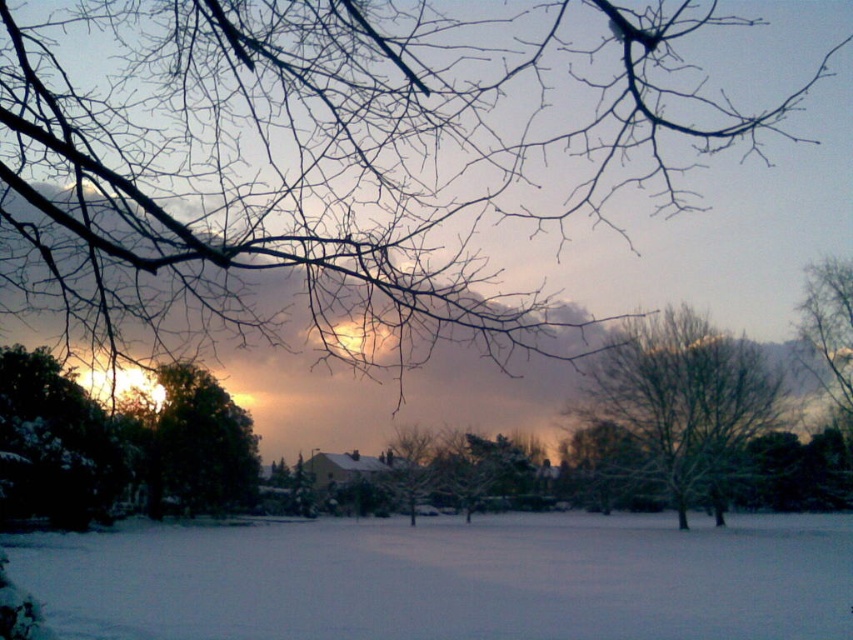
Question: Can you confirm if white powdery snow at center is positioned to the left of bare branches at upper right?

Choices:
 (A) no
 (B) yes

Answer: (B)

Question: Which point appears farthest from the camera in this image?

Choices:
 (A) (845, 403)
 (B) (160, 488)
 (C) (746, 397)
 (D) (67, 88)

Answer: (C)

Question: Is white powdery snow at center wider than snow-covered tree at center?

Choices:
 (A) yes
 (B) no

Answer: (A)

Question: Which point is closer to the camera?

Choices:
 (A) green matte tree at center
 (B) bare branches at upper center
 (C) bare branches at upper right
 (D) snow-covered tree at center

Answer: (D)

Question: Is bare branches at upper center bigger than bare branches at upper right?

Choices:
 (A) yes
 (B) no

Answer: (B)

Question: Which point is farther to the camera?

Choices:
 (A) snow-covered tree at center
 (B) bare branches at upper right
 (C) white powdery snow at center

Answer: (B)